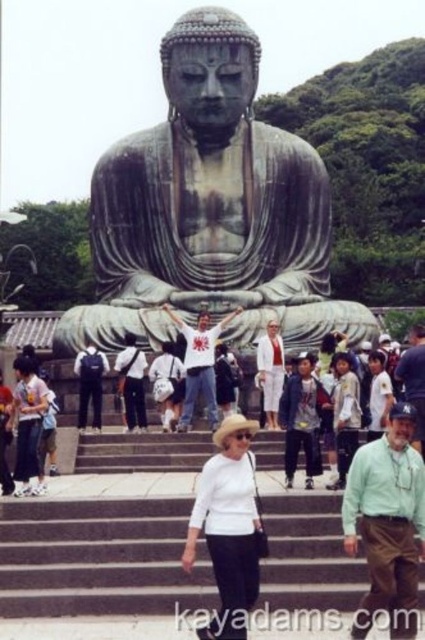
You are a photographer standing at the base of the stone steps leading to the seated Buddha statue. You notice a white matte hat at center and a white cotton shirt at lower left in your view. Which object appears bigger in your camera view?

The white matte hat at center appears bigger in the camera view because it has a larger size compared to the white cotton shirt at lower left.

You are a photographer planning to take a group photo of the tourists in front of the seated Buddha statue. You want to ensure that both the white matte hat at center and the matte black backpack at center are visible in the photo. Given their heights, which object might block the view of the other when framing the shot?

The white matte hat at center is much taller than the matte black backpack at center, so it might block the view of the backpack if positioned in front.

You are a photographer wanting to capture a photo of the seated Buddha statue. You notice a white matte hat at center and a white cotton shirt at lower left in the foreground. Which object should you adjust your camera angle to avoid blocking the statue, considering their sizes?

The white matte hat at center is wider than the white cotton shirt at lower left, so adjusting the camera angle to move the white matte hat at center out of the frame would prevent it from blocking the statue more effectively.